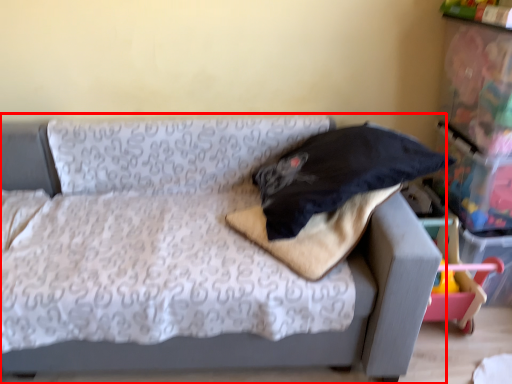
Question: From the image's perspective, what is the correct spatial relationship of studio couch (annotated by the red box) in relation to pillow?

Choices:
 (A) above
 (B) below

Answer: (B)